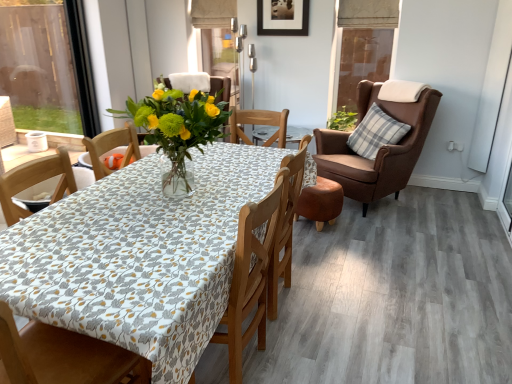
Question: Should I look upward or downward to see plaid fabric pillow at right?

Choices:
 (A) down
 (B) up

Answer: (B)

Question: Considering the relative positions of wooden chair at center, arranged as the 2th chair when viewed from the right, and plaid fabric pillow at right in the image provided, is wooden chair at center, arranged as the 2th chair when viewed from the right, behind plaid fabric pillow at right?

Choices:
 (A) no
 (B) yes

Answer: (A)

Question: Is wooden chair at center, which ranks as the first chair in left-to-right order, outside of plaid fabric pillow at right?

Choices:
 (A) no
 (B) yes

Answer: (B)

Question: Are wooden chair at center, which ranks as the first chair in left-to-right order, and plaid fabric pillow at right located far from each other?

Choices:
 (A) yes
 (B) no

Answer: (A)

Question: Is wooden chair at center, which ranks as the first chair in left-to-right order, to the left of plaid fabric pillow at right from the viewer's perspective?

Choices:
 (A) no
 (B) yes

Answer: (B)

Question: From the image's perspective, is wooden chair at center, which ranks as the first chair in left-to-right order, over plaid fabric pillow at right?

Choices:
 (A) yes
 (B) no

Answer: (B)

Question: Is wooden chair at center, the 1th chair from the front, wider than plaid fabric pillow at right?

Choices:
 (A) yes
 (B) no

Answer: (A)

Question: Is translucent glass vase at center next to brown leather armchair at right, arranged as the second chair when viewed from the front, and touching it?

Choices:
 (A) no
 (B) yes

Answer: (A)

Question: Can you confirm if translucent glass vase at center is taller than brown leather armchair at right, the first chair positioned from the back?

Choices:
 (A) no
 (B) yes

Answer: (A)

Question: Does translucent glass vase at center come behind brown leather armchair at right, which is the 2th chair from left to right?

Choices:
 (A) yes
 (B) no

Answer: (B)

Question: Could you tell me if translucent glass vase at center is facing brown leather armchair at right, arranged as the second chair when viewed from the front?

Choices:
 (A) yes
 (B) no

Answer: (B)

Question: Is translucent glass vase at center shorter than brown leather armchair at right, the 1th chair from the right?

Choices:
 (A) yes
 (B) no

Answer: (A)

Question: Can brown leather armchair at right, the first chair positioned from the back, be found inside translucent glass vase at center?

Choices:
 (A) yes
 (B) no

Answer: (B)

Question: Is plaid fabric pillow at right surrounding transparent glass window screen at upper right?

Choices:
 (A) no
 (B) yes

Answer: (A)